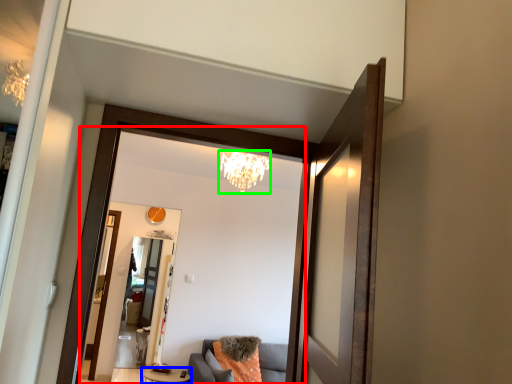
Question: Which object is the closest to the mirror (highlighted by a red box)? Choose among these: table (highlighted by a blue box) or light fixture (highlighted by a green box).

Choices:
 (A) table
 (B) light fixture

Answer: (B)